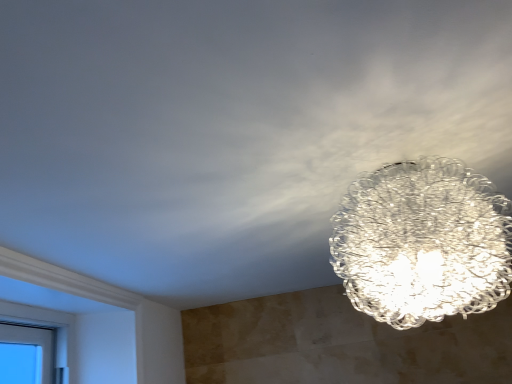
At what (x,y) coordinates should I click in order to perform the action: click on clear glass chandelier at upper right. Please return your answer as a coordinate pair (x, y). Looking at the image, I should click on (423, 242).

What is the approximate width of clear glass chandelier at upper right?

clear glass chandelier at upper right is 42.32 centimeters in width.

Describe the element at coordinates (423, 242) in the screenshot. I see `clear glass chandelier at upper right` at that location.

At what (x,y) coordinates should I click in order to perform the action: click on clear glass chandelier at upper right. Please return your answer as a coordinate pair (x, y). This screenshot has width=512, height=384. Looking at the image, I should click on (423, 242).